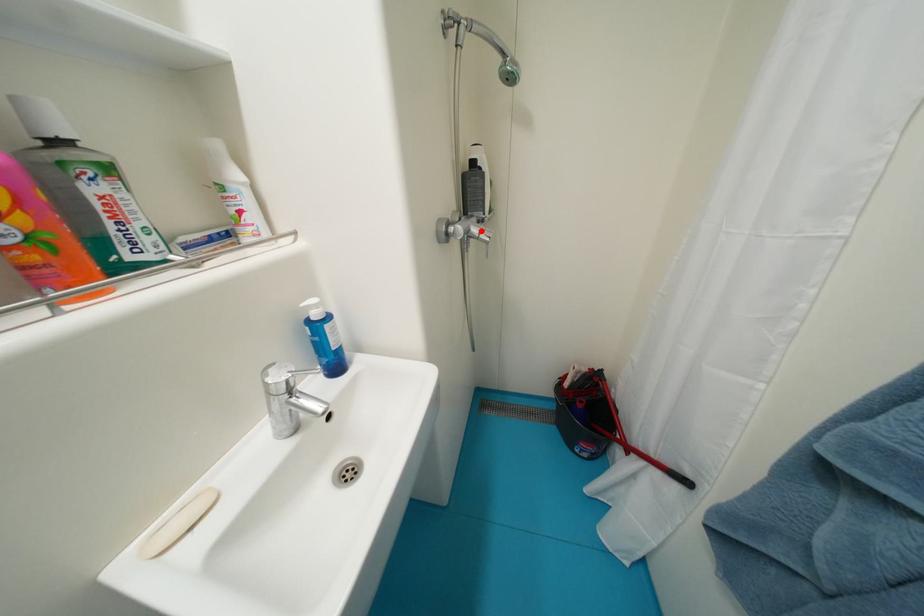
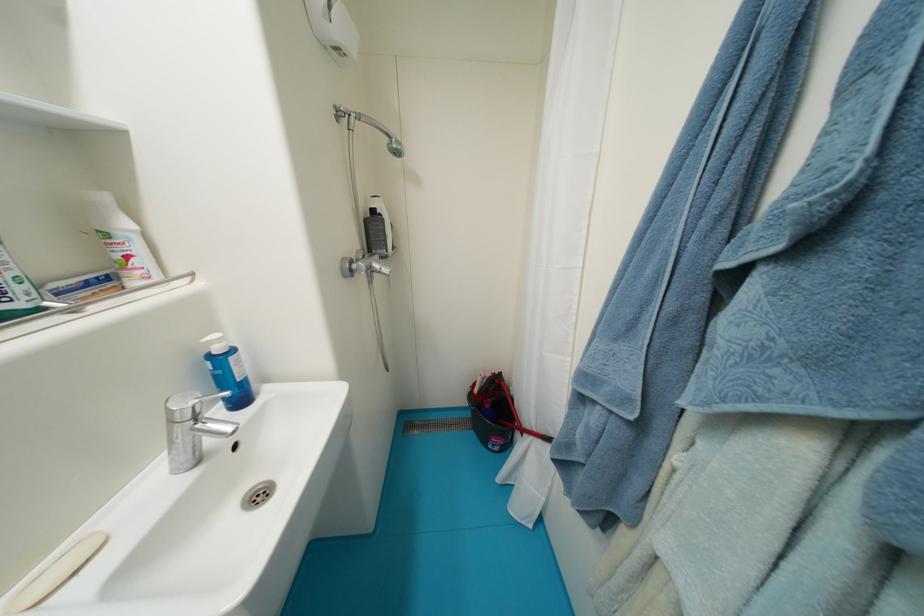
Find the pixel in the second image that matches the highlighted location in the first image.

(383, 267)